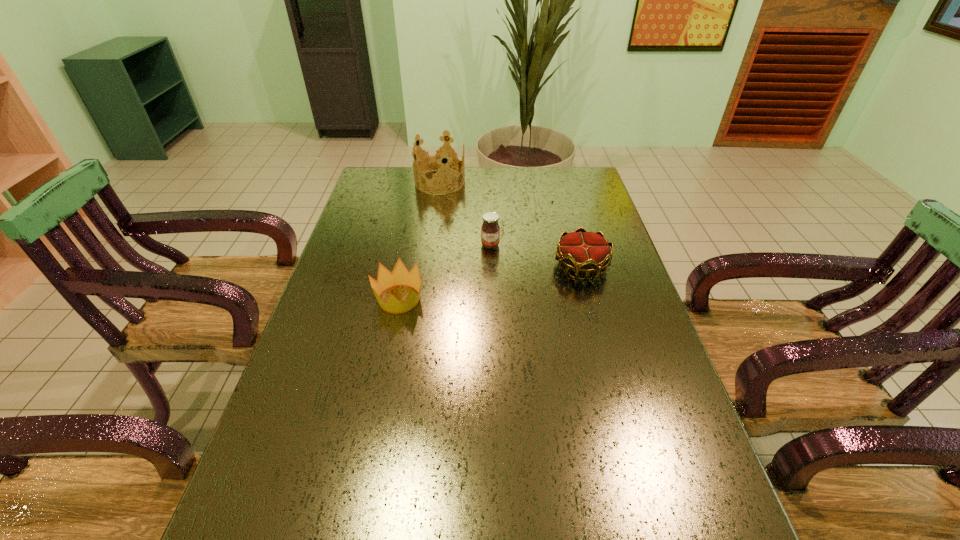
At what (x,y) coordinates should I click in order to perform the action: click on the farthest crown. Please return your answer as a coordinate pair (x, y). The height and width of the screenshot is (540, 960). Looking at the image, I should click on (438, 161).

The image size is (960, 540). Find the location of `the tallest crown`. the tallest crown is located at coordinates (438, 161).

Find the location of a particular element. The height and width of the screenshot is (540, 960). the second tallest object is located at coordinates (490, 230).

Find the location of `jam`. jam is located at coordinates (490, 230).

Where is `the rightmost crown`? The width and height of the screenshot is (960, 540). the rightmost crown is located at coordinates (587, 252).

Identify the location of free point located on the front of the farthest crown. The width and height of the screenshot is (960, 540). (435, 216).

The height and width of the screenshot is (540, 960). Identify the location of vacant space located on the label side of the third shortest object. (491, 269).

I want to click on vacant point located 0.170m on the front of the rightmost crown, so click(598, 329).

In order to click on object that is at the far edge in this screenshot , I will do `click(438, 161)`.

Locate an element on the screen. The width and height of the screenshot is (960, 540). object at the left edge is located at coordinates [400, 276].